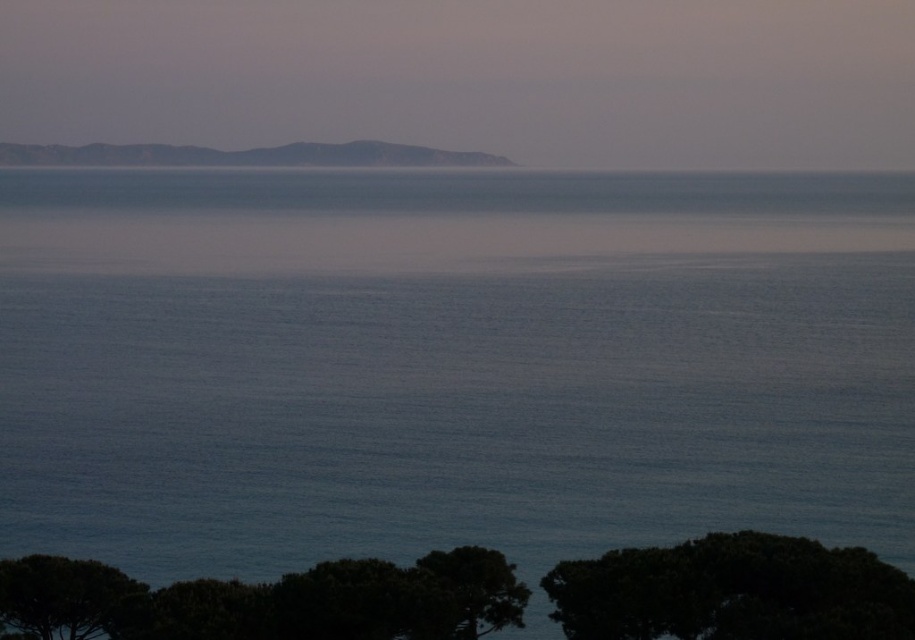
You are standing at the edge of the ocean looking out toward the horizon. You notice two points in the scene labeled as point (536, 449) and point (453, 160). Which point is closer to your position?

Point (536, 449) is closer to the camera than point (453, 160), so the point closer to your position is point (536, 449).

Consider the image. You are standing on a beach and see the green leafy tree at lower center and the dark green leafy tree at lower left. Which tree would block your view of the ocean if you were to stand directly in front of it?

The green leafy tree at lower center would block your view of the ocean because it is bigger than the dark green leafy tree at lower left.